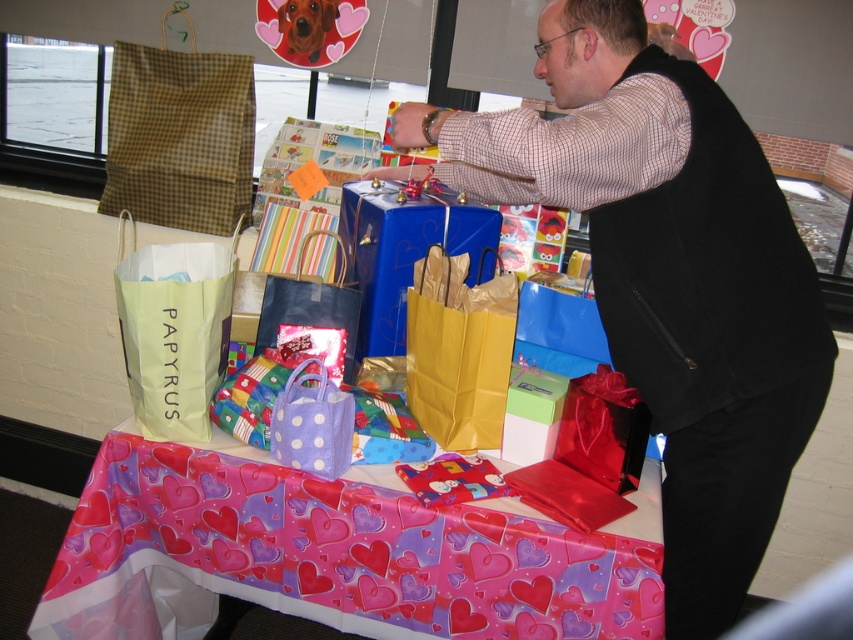
You are standing in a gift shop and see a table with various gift bags and boxes. There is a point marked at coordinates (335,554). What is located at this point on the table?

The point at coordinates (335,554) indicates valentine patterned paper at center.

You are a customer trying to decide between the matte black vest at center and the shiny black bag at lower right. Which item has a greater width?

The matte black vest at center has a greater width than the shiny black bag at lower right.